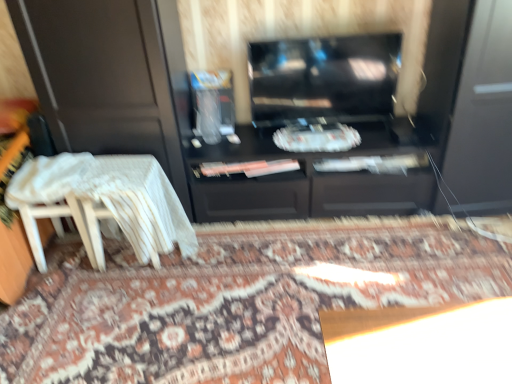
Question: Considering the relative sizes of white wood chair at left and clear plastic container at center in the image provided, is white wood chair at left smaller than clear plastic container at center?

Choices:
 (A) yes
 (B) no

Answer: (B)

Question: Is white wood chair at left surrounding clear plastic container at center?

Choices:
 (A) no
 (B) yes

Answer: (A)

Question: Is the depth of white wood chair at left greater than that of clear plastic container at center?

Choices:
 (A) no
 (B) yes

Answer: (A)

Question: From the image's perspective, is white wood chair at left located beneath clear plastic container at center?

Choices:
 (A) no
 (B) yes

Answer: (B)

Question: Is white wood chair at left completely or partially outside of clear plastic container at center?

Choices:
 (A) yes
 (B) no

Answer: (A)

Question: Which is correct: clear plastic container at center is inside glossy black tv at center, or outside of it?

Choices:
 (A) inside
 (B) outside

Answer: (B)

Question: From their relative heights in the image, would you say clear plastic container at center is taller or shorter than glossy black tv at center?

Choices:
 (A) short
 (B) tall

Answer: (A)

Question: Considering the positions of clear plastic container at center and glossy black tv at center in the image, is clear plastic container at center wider or thinner than glossy black tv at center?

Choices:
 (A) wide
 (B) thin

Answer: (A)

Question: From the image's perspective, is clear plastic container at center above or below glossy black tv at center?

Choices:
 (A) below
 (B) above

Answer: (A)

Question: From a real-world perspective, relative to patterned carpet at center, is clear plastic container at center vertically above or below?

Choices:
 (A) above
 (B) below

Answer: (A)

Question: Is clear plastic container at center taller or shorter than patterned carpet at center?

Choices:
 (A) tall
 (B) short

Answer: (A)

Question: In terms of width, does clear plastic container at center look wider or thinner when compared to patterned carpet at center?

Choices:
 (A) thin
 (B) wide

Answer: (A)

Question: Considering the relative positions of clear plastic container at center and patterned carpet at center in the image provided, is clear plastic container at center to the left or to the right of patterned carpet at center?

Choices:
 (A) left
 (B) right

Answer: (A)

Question: In terms of width, does white lace table at lower left look wider or thinner when compared to clear plastic container at center?

Choices:
 (A) thin
 (B) wide

Answer: (B)

Question: Looking at the image, does white lace table at lower left seem bigger or smaller compared to clear plastic container at center?

Choices:
 (A) small
 (B) big

Answer: (B)